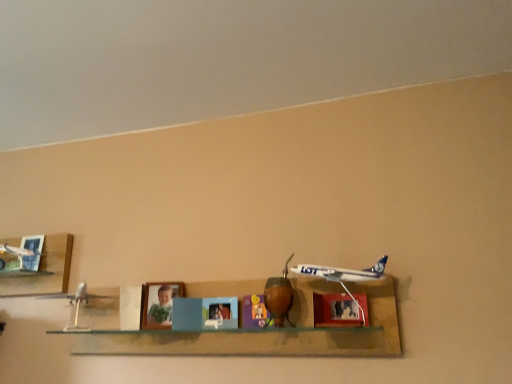
Question: Is metallic blue airplane at center facing towards brushed metal picture frame at upper left, marked as the second picture frame in a right-to-left arrangement?

Choices:
 (A) no
 (B) yes

Answer: (A)

Question: Considering the relative sizes of metallic blue airplane at center and brushed metal picture frame at upper left, which is counted as the 1th picture frame, starting from the left, in the image provided, is metallic blue airplane at center thinner than brushed metal picture frame at upper left, which is counted as the 1th picture frame, starting from the left,?

Choices:
 (A) no
 (B) yes

Answer: (A)

Question: Is metallic blue airplane at center to the left of brushed metal picture frame at upper left, which appears as the 2th picture frame when viewed from the front, from the viewer's perspective?

Choices:
 (A) no
 (B) yes

Answer: (A)

Question: From the image's perspective, would you say metallic blue airplane at center is positioned over brushed metal picture frame at upper left, the 1th picture frame when ordered from back to front?

Choices:
 (A) no
 (B) yes

Answer: (A)

Question: Is metallic blue airplane at center bigger than brushed metal picture frame at upper left, marked as the second picture frame in a right-to-left arrangement?

Choices:
 (A) no
 (B) yes

Answer: (B)

Question: In terms of width, does brushed metal airplane at left, which is the second shelf in right-to-left order, look wider or thinner when compared to white glossy airplane at center, the 1th shelf viewed from the right?

Choices:
 (A) wide
 (B) thin

Answer: (B)

Question: Considering the positions of brushed metal airplane at left, which is the second shelf in right-to-left order, and white glossy airplane at center, which is the second shelf in left-to-right order, in the image, is brushed metal airplane at left, which is the second shelf in right-to-left order, bigger or smaller than white glossy airplane at center, which is the second shelf in left-to-right order,?

Choices:
 (A) small
 (B) big

Answer: (A)

Question: From a real-world perspective, is brushed metal airplane at left, which ranks as the first shelf in left-to-right order, positioned above or below white glossy airplane at center, the 1th shelf viewed from the right?

Choices:
 (A) below
 (B) above

Answer: (B)

Question: In terms of height, does brushed metal airplane at left, which ranks as the first shelf in left-to-right order, look taller or shorter compared to white glossy airplane at center, the 1th shelf viewed from the right?

Choices:
 (A) tall
 (B) short

Answer: (B)

Question: Looking at their shapes, would you say matte wooden picture frame at center, the 2th picture frame viewed from the back, is wider or thinner than brushed metal airplane at left, which is the second shelf in right-to-left order?

Choices:
 (A) thin
 (B) wide

Answer: (A)

Question: Do you think matte wooden picture frame at center, which is the first picture frame in front-to-back order, is within brushed metal airplane at left, which ranks as the first shelf in left-to-right order, or outside of it?

Choices:
 (A) inside
 (B) outside

Answer: (B)

Question: From the image's perspective, is matte wooden picture frame at center, arranged as the 1th picture frame when viewed from the right, above or below brushed metal airplane at left, which is the second shelf in right-to-left order?

Choices:
 (A) below
 (B) above

Answer: (A)

Question: Is point (321, 319) positioned closer to the camera than point (69, 241)?

Choices:
 (A) closer
 (B) farther

Answer: (A)

Question: Considering the positions of point (287, 339) and point (355, 306), is point (287, 339) closer or farther from the camera than point (355, 306)?

Choices:
 (A) farther
 (B) closer

Answer: (A)

Question: From a real-world perspective, relative to matte wooden picture frame at center, arranged as the 1th picture frame when viewed from the right, is white glossy airplane at center, which is the second shelf in left-to-right order, vertically above or below?

Choices:
 (A) above
 (B) below

Answer: (B)